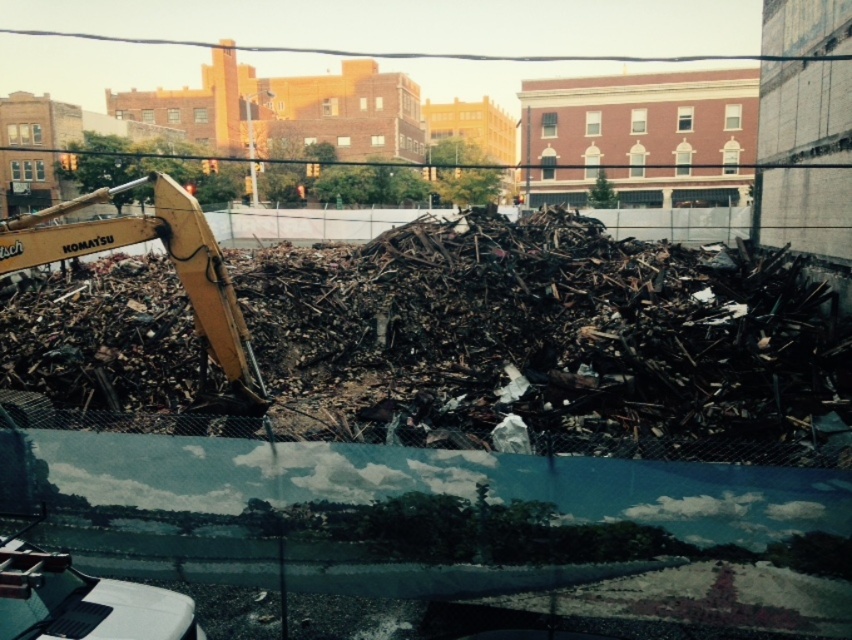
You are a construction worker who needs to move a heavy object from the dark metallic debris at center to the yellow metallic excavator at left. Which object is taller so you can determine where to place the object more securely?

The yellow metallic excavator at left is taller than the dark metallic debris at center, so placing the heavy object on the yellow metallic excavator at left would be more secure.

Based on the photo, you are a construction worker who needs to move a 3.5 meter wide container through the space between the dark metallic debris at center and the yellow metallic excavator at left. Can you fit the container through that space?

The dark metallic debris at center has a width less than the yellow metallic excavator at left. Therefore, the total available space between them would be the sum of their widths. However, since the debris is narrower than the excavator, the combined width might still be sufficient for the 3.5 meter container. Without exact measurements, it is uncertain, but the description suggests there is enough space.